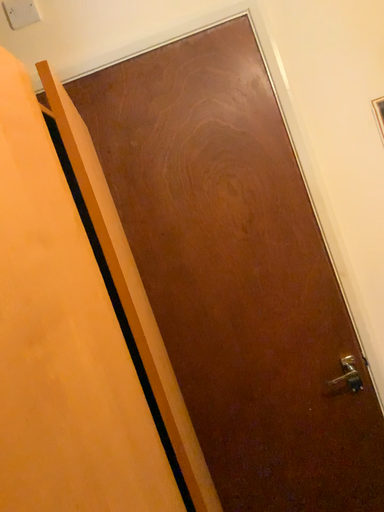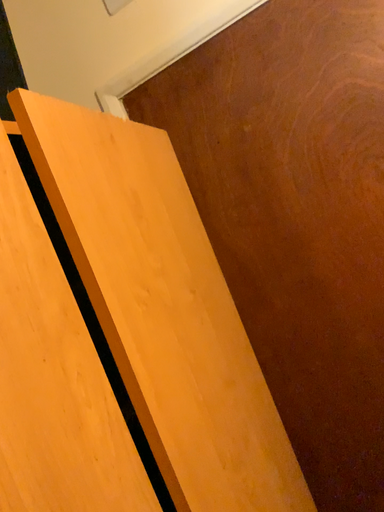
Question: Which way did the camera rotate in the video?

Choices:
 (A) rotated downward
 (B) rotated upward

Answer: (A)